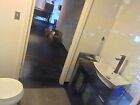
Help me find where you'd open the cabinet in the image by pointing to them. Your answer should be formatted as a list of tuples, i.e. [(x1, y1), (x2, y2), ...], where each tuple contains the x and y coordinates of a point satisfying the conditions above.

[(81, 87), (82, 89)]